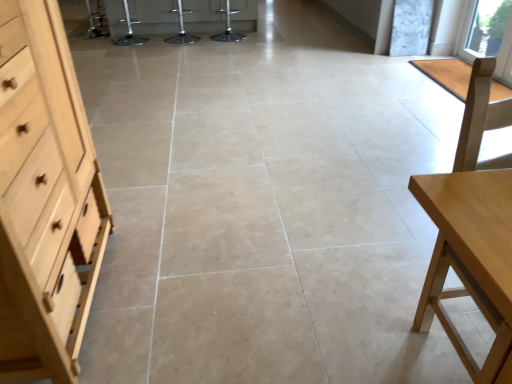
Question: In the image, is light wood dresser at left positioned in front of or behind light wood table at right?

Choices:
 (A) front
 (B) behind

Answer: (A)

Question: In terms of width, does light wood dresser at left look wider or thinner when compared to light wood table at right?

Choices:
 (A) wide
 (B) thin

Answer: (A)

Question: Based on their relative distances, which object is nearer to the metallic silver bar stool at center, which appears as the 1th bar stool when viewed from the left?

Choices:
 (A) light wood table at right
 (B) metallic silver bar stool at center, which is the third bar stool from left to right
 (C) light wood dresser at left
 (D) metallic silver bar stool at center, arranged as the second bar stool when viewed from the left
 (E) transparent glass window at upper right

Answer: (D)

Question: Which object is positioned closest to the metallic silver bar stool at center, positioned as the third bar stool in right-to-left order?

Choices:
 (A) metallic silver bar stool at center, which is the 2th bar stool from right to left
 (B) light wood dresser at left
 (C) light wood table at right
 (D) transparent glass window at upper right
 (E) metallic silver bar stool at center, the 1th bar stool positioned from the right

Answer: (A)